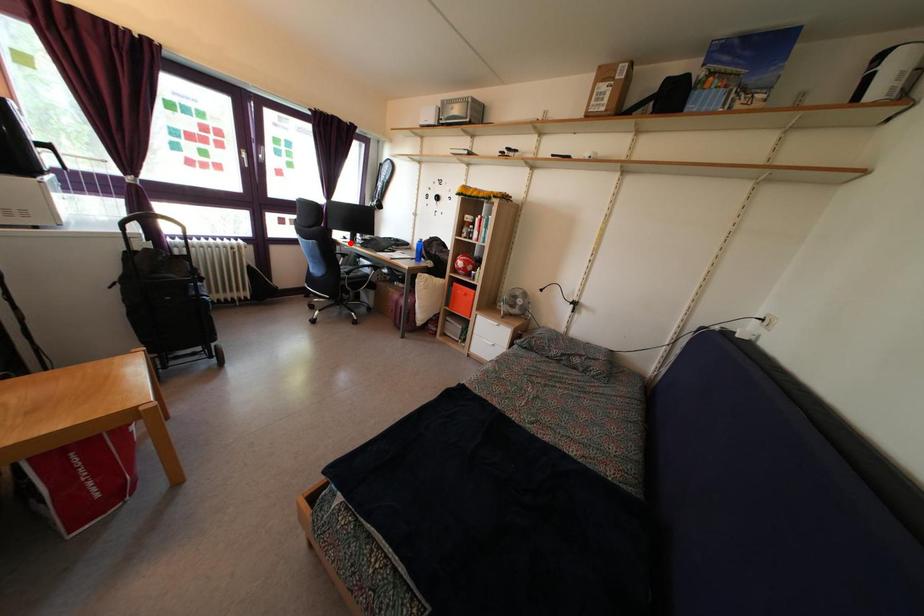
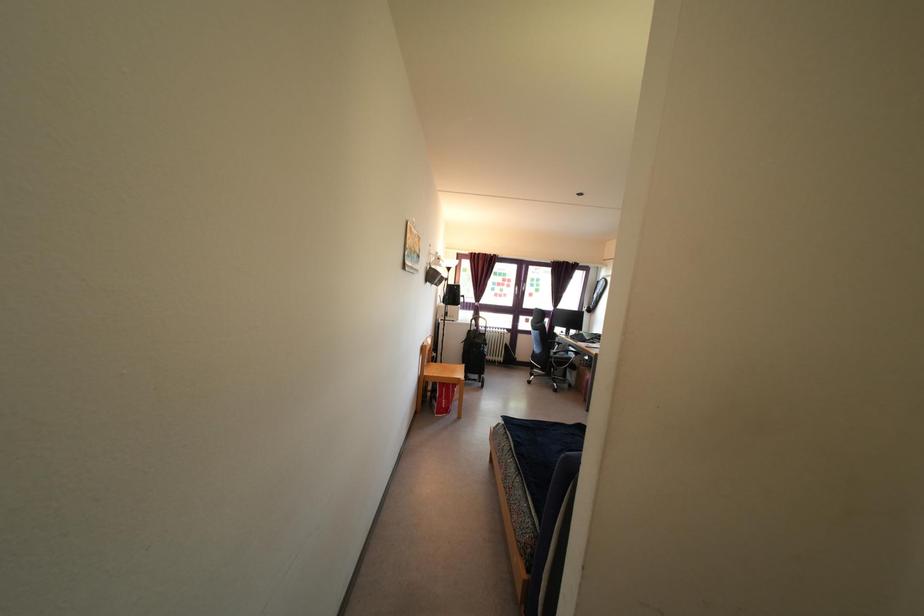
Question: A red point is marked in image1. In image2, is the corresponding 3D point closer to the camera or farther? Reply with the corresponding letter.

Choices:
 (A) The corresponding 3D point is closer.
 (B) The corresponding 3D point is farther.

Answer: (B)